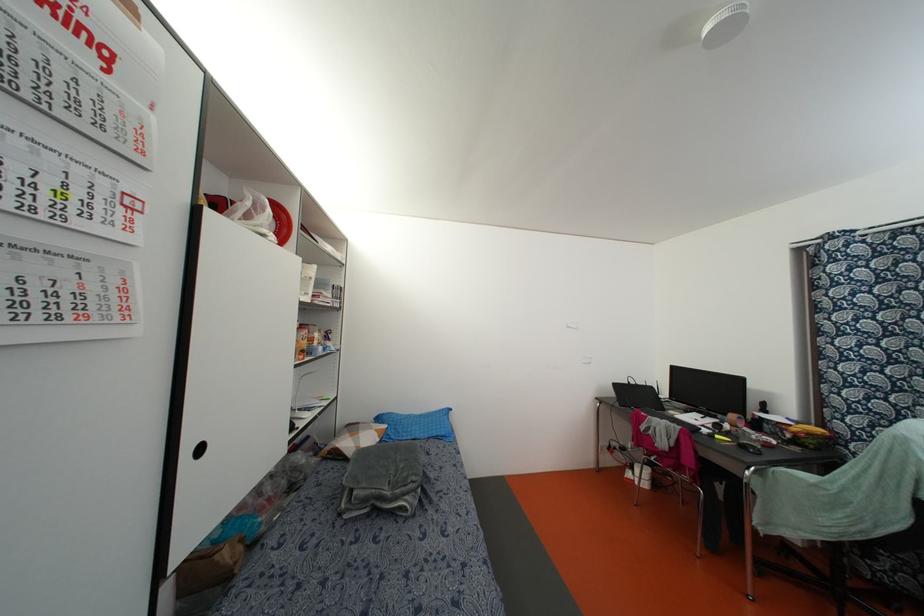
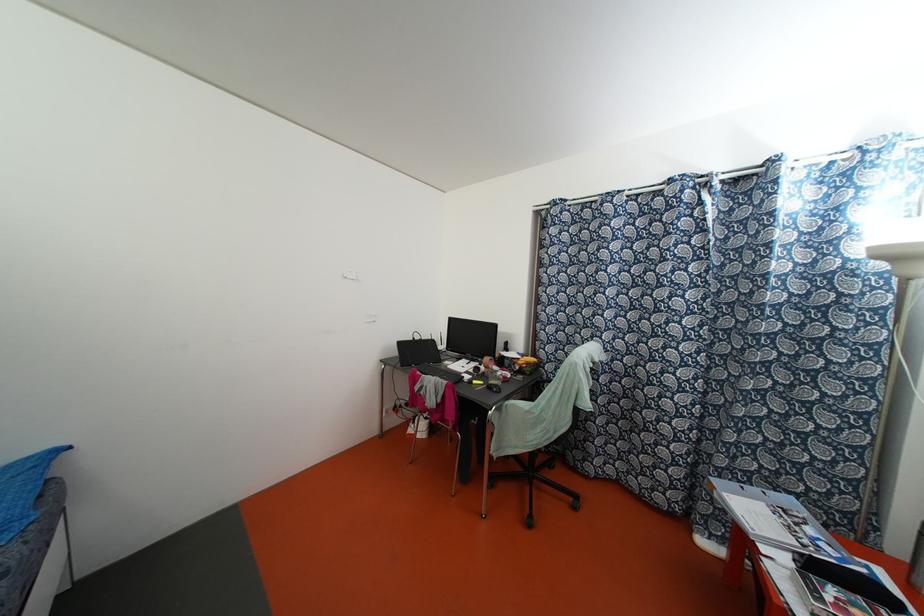
Question: Based on the continuous images, in which direction is the camera rotating? Reply with the corresponding letter.

Choices:
 (A) Left
 (B) Right
 (C) Up
 (D) Down

Answer: (B)